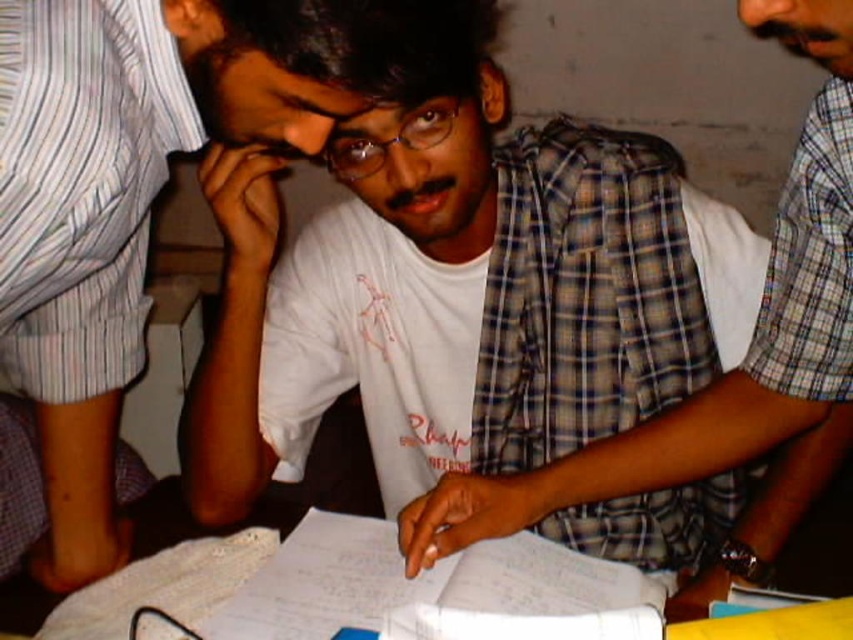
You are organizing a photo shoot and need to ensure that all participants are visible in the frame. Given that the white matte shirt at center and the plaid fabric shirt at center are both important subjects, which one might require more attention to ensure it is fully captured in the photo?

The plaid fabric shirt at center occupies more space than the white matte shirt at center, so it might require more attention to ensure it is fully captured in the photo.

You are taking a photo of the scene and want to focus on both point (102,44) and point (437,586). Which point should you focus on first to ensure both are in focus?

You should focus on point (102,44) first because it is closer to the camera than point (437,586), so focusing on the closer point will help ensure both are in focus.